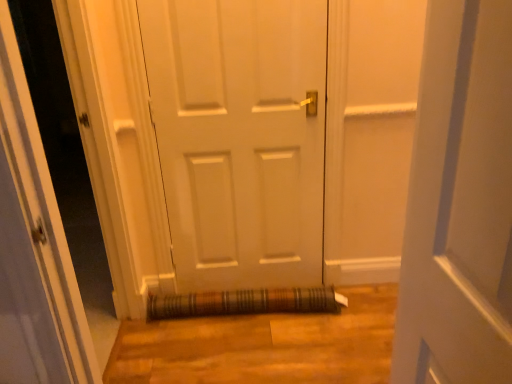
Question: From a real-world perspective, is white matte door at center above or below brown woven mat at lower center?

Choices:
 (A) below
 (B) above

Answer: (B)

Question: From the image's perspective, is white matte door at center located above or below brown woven mat at lower center?

Choices:
 (A) below
 (B) above

Answer: (B)

Question: Based on their relative distances, which object is nearer to the white matte door at center?

Choices:
 (A) transparent glass door at center
 (B) brown woven mat at lower center

Answer: (B)

Question: Which of these objects is positioned farthest from the white matte door at center?

Choices:
 (A) transparent glass door at center
 (B) brown woven mat at lower center

Answer: (A)